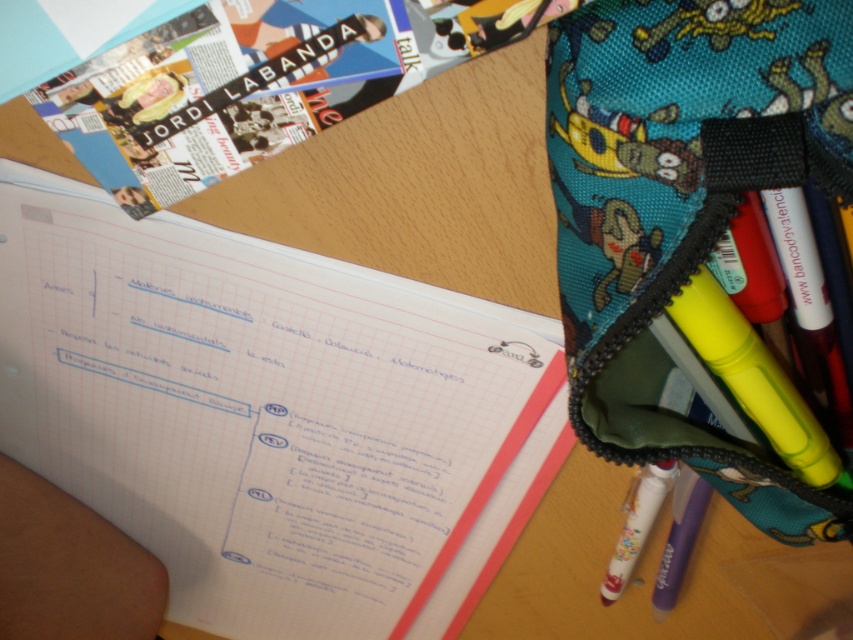
Question: Among these objects, which one is nearest to the camera?

Choices:
 (A) matte purple pen at lower right
 (B) white grid paper at upper left
 (C) white matte pen at lower right

Answer: (C)

Question: Among these objects, which one is farthest from the camera?

Choices:
 (A) white grid paper at upper left
 (B) matte purple pen at lower right
 (C) teal fabric pencil case at right
 (D) white matte pen at lower right

Answer: (B)

Question: Considering the real-world distances, which object is farthest from the white matte pen at lower right?

Choices:
 (A) matte purple pen at lower right
 (B) white grid paper at upper left
 (C) teal fabric pencil case at right

Answer: (B)

Question: Does white matte pen at lower right have a larger size compared to matte purple pen at lower right?

Choices:
 (A) yes
 (B) no

Answer: (A)

Question: Can you confirm if white grid paper at upper left is thinner than matte purple pen at lower right?

Choices:
 (A) yes
 (B) no

Answer: (B)

Question: Is white grid paper at upper left in front of teal fabric pencil case at right?

Choices:
 (A) no
 (B) yes

Answer: (A)